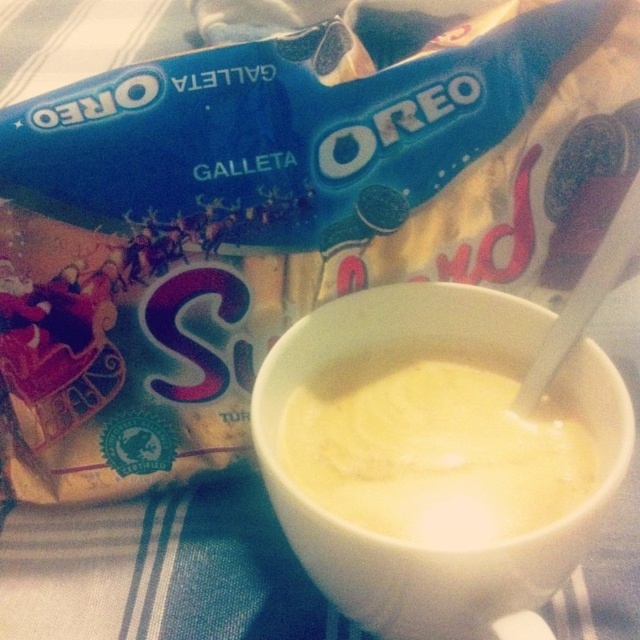
You are at a restaurant and see a white ceramic mug with two items inside. One is labeled as yellow creamy liquid at center and the other is yellow creamy soup at center. The server asks which one is larger in size. Based on the image, which one should you point to?

The yellow creamy liquid at center is bigger than the yellow creamy soup at center, so you should point to the yellow creamy liquid at center.

You are a barista preparing a drink and need to pour the yellow creamy liquid at center into a taller glass. Based on the scene, can you determine if the yellow creamy soup at center will fit into the same glass without overflowing?

The yellow creamy liquid at center is much taller than the yellow creamy soup at center, so pouring the soup into the glass that held the liquid would likely leave space and prevent overflow.